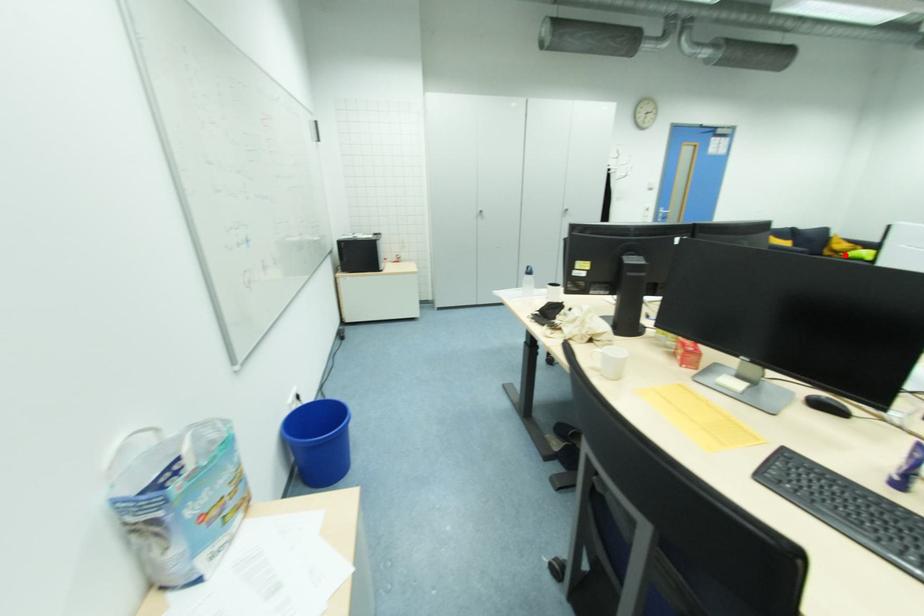
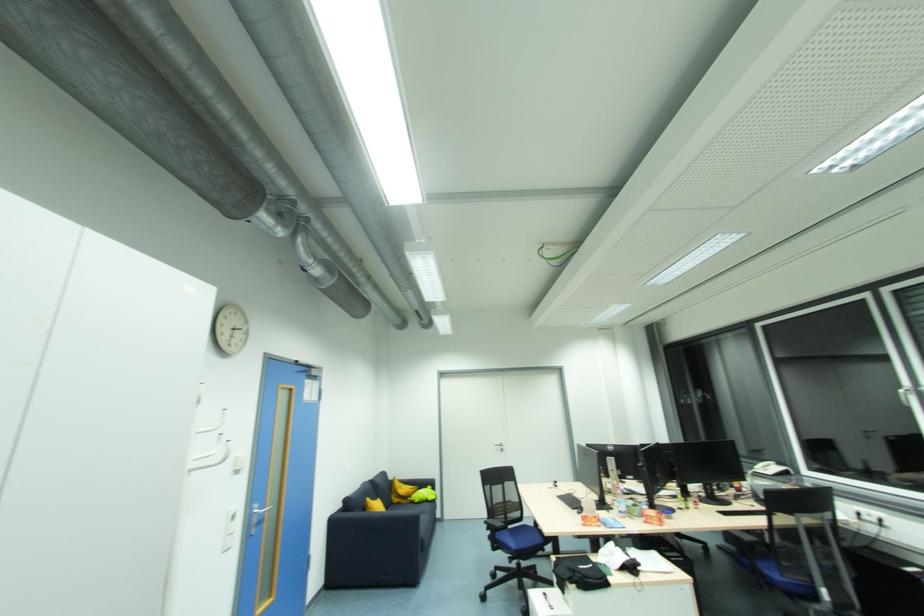
Question: I am providing you with two images of the same scene from different viewpoints. A red point is shown in image1. For the corresponding object point in image2, is it positioned nearer or farther from the camera?

Choices:
 (A) Nearer
 (B) Farther

Answer: (A)